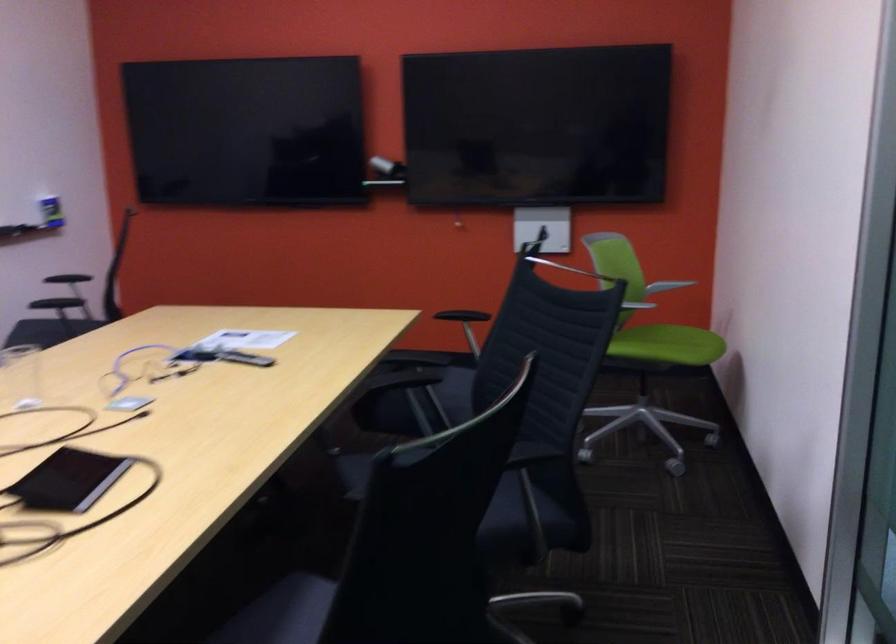
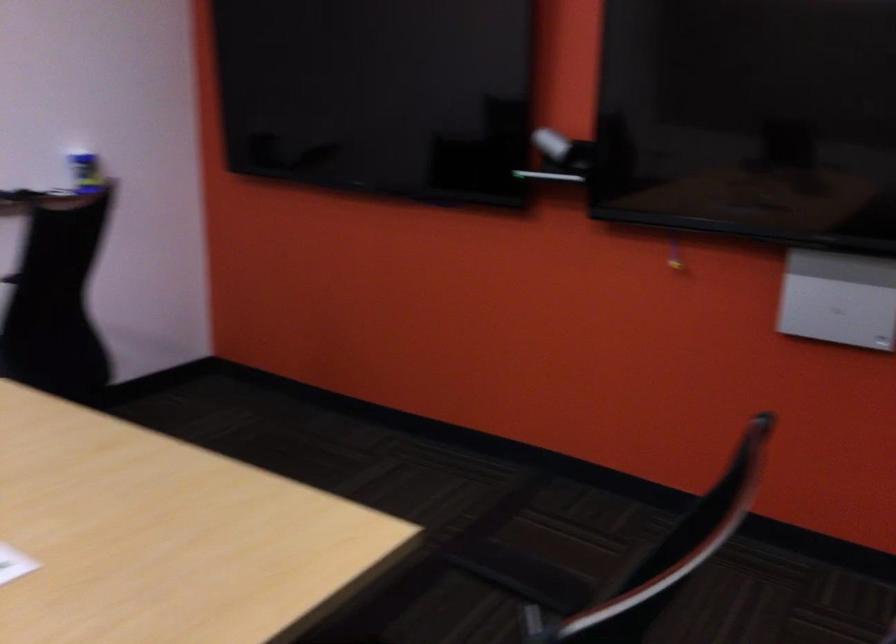
Question: What movement of the cameraman would produce the second image?

Choices:
 (A) Left
 (B) Right
 (C) Forward
 (D) Backward

Answer: (C)